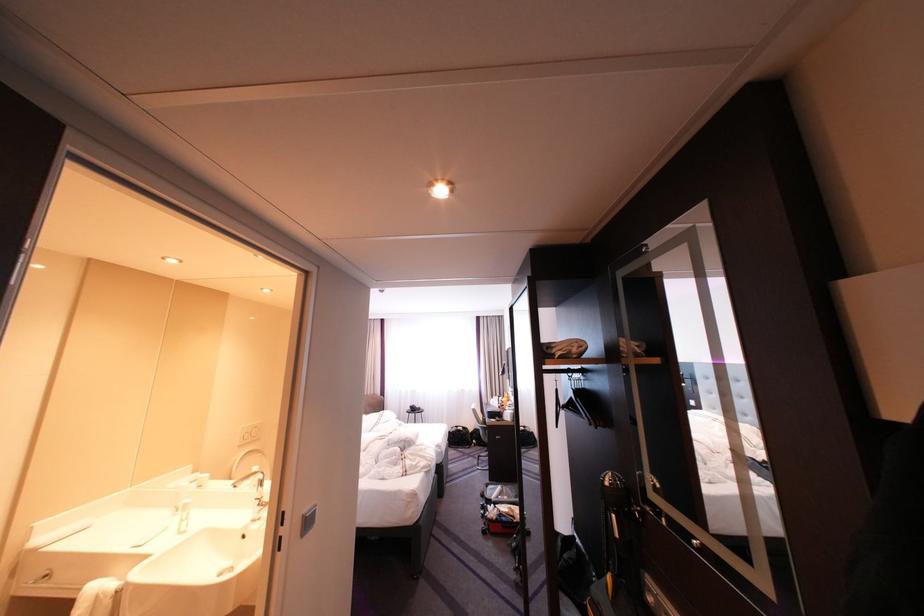
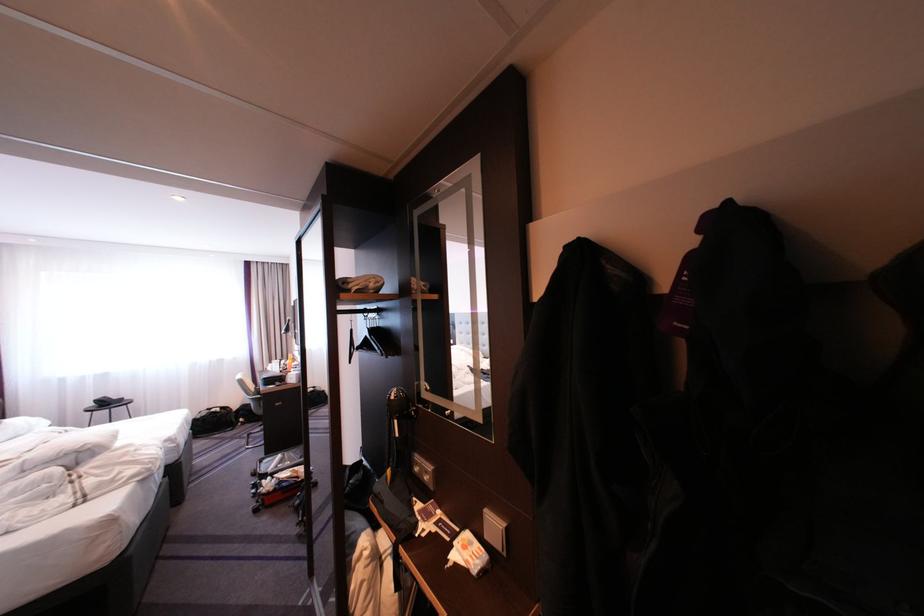
The point at (x=491, y=424) is marked in the first image. Where is the corresponding point in the second image?

(261, 395)